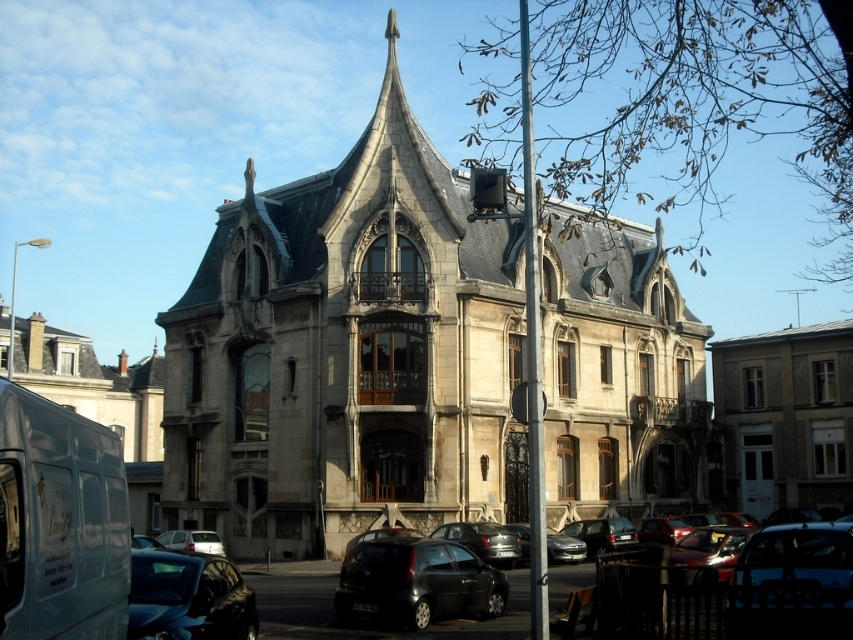
Question: Which of the following is the farthest from the observer?

Choices:
 (A) white stone church at left
 (B) shiny blue car at lower left
 (C) shiny black sedan at lower right

Answer: (A)

Question: Can you confirm if stone church at center is smaller than white matte van at lower left?

Choices:
 (A) yes
 (B) no

Answer: (B)

Question: Can you confirm if shiny black car at center is positioned to the left of white matte car at lower left?

Choices:
 (A) yes
 (B) no

Answer: (B)

Question: Which of the following is the farthest from the observer?

Choices:
 (A) pyautogui.click(x=462, y=557)
 (B) pyautogui.click(x=556, y=291)

Answer: (B)

Question: Which point appears farthest from the camera in this image?

Choices:
 (A) click(39, 371)
 (B) click(186, 547)
 (C) click(97, 561)

Answer: (A)

Question: Is stone church at center positioned behind shiny black sedan at lower right?

Choices:
 (A) no
 (B) yes

Answer: (B)